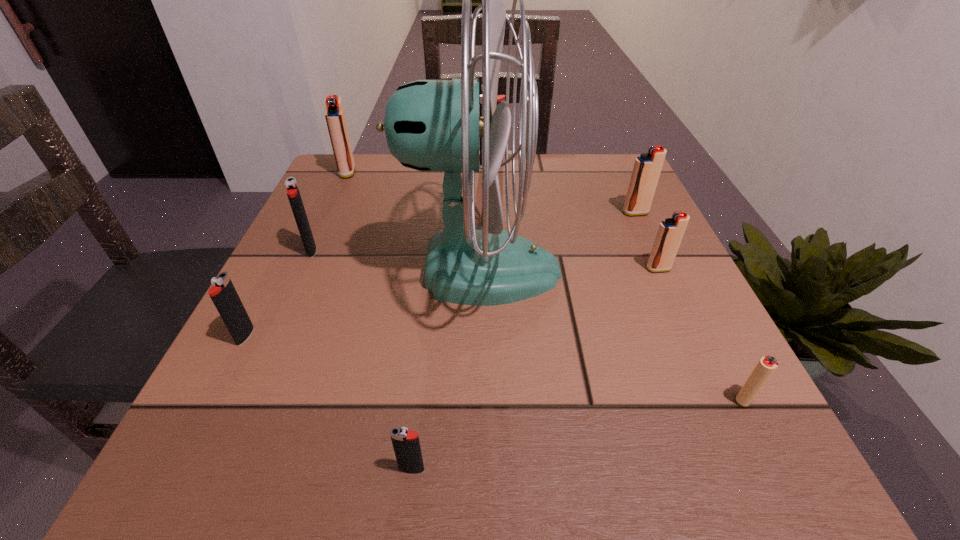
This screenshot has width=960, height=540. I want to click on unoccupied area between the eighth farthest object and the leftmost black igniter, so click(495, 367).

You are a GUI agent. You are given a task and a screenshot of the screen. Output one action in this format:
    pyautogui.click(x=<x>, y=<y>)
    Task: Click on the free point between the seventh farthest igniter and the third farthest red igniter
    
    Given the screenshot: What is the action you would take?
    pyautogui.click(x=702, y=334)

Find the location of a particular element. The width and height of the screenshot is (960, 540). vacant area that lies between the second farthest black igniter and the tallest object is located at coordinates (396, 260).

Select which object appears as the closest to the second biggest red igniter. Please provide its 2D coordinates. Your answer should be formatted as a tuple, i.e. [(x, y)], where the tuple contains the x and y coordinates of a point satisfying the conditions above.

[(670, 233)]

Locate which object ranks seventh in proximity to the third farthest igniter. Please provide its 2D coordinates. Your answer should be formatted as a tuple, i.e. [(x, y)], where the tuple contains the x and y coordinates of a point satisfying the conditions above.

[(406, 444)]

Locate which igniter is the seventh closest to the second nearest igniter. Please provide its 2D coordinates. Your answer should be formatted as a tuple, i.e. [(x, y)], where the tuple contains the x and y coordinates of a point satisfying the conditions above.

[(335, 117)]

The image size is (960, 540). I want to click on the fifth closest igniter to the tallest object, so click(x=500, y=98).

Locate which red igniter is the fourth closest to the biggest black igniter. Please provide its 2D coordinates. Your answer should be formatted as a tuple, i.e. [(x, y)], where the tuple contains the x and y coordinates of a point satisfying the conditions above.

[(766, 366)]

Find the location of `red igniter that is the third nearest to the second nearest red igniter`. red igniter that is the third nearest to the second nearest red igniter is located at coordinates click(x=335, y=117).

Identify which black igniter is located as the nearest to the leftmost object. Please provide its 2D coordinates. Your answer should be formatted as a tuple, i.e. [(x, y)], where the tuple contains the x and y coordinates of a point satisfying the conditions above.

[(292, 190)]